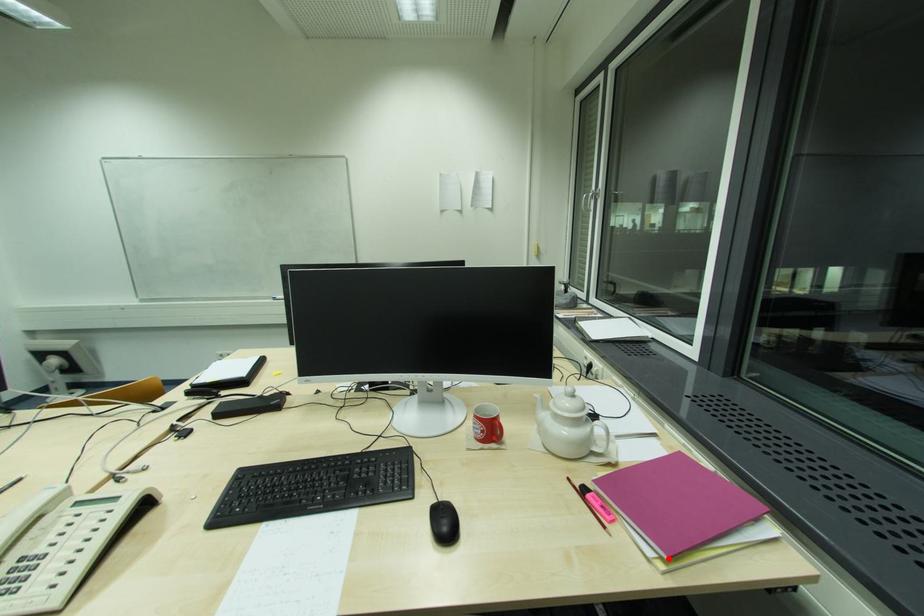
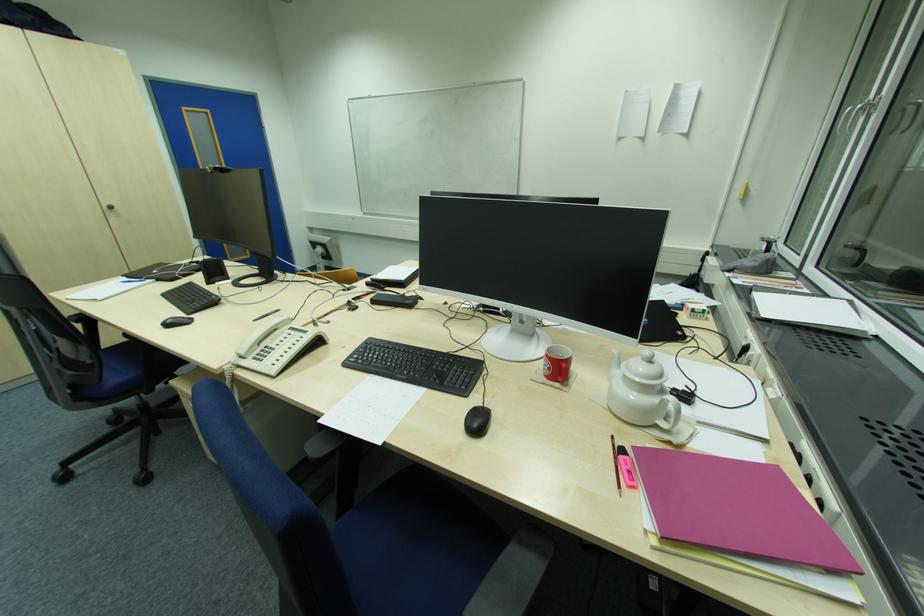
The point at the highlighted location is marked in the first image. Where is the corresponding point in the second image?

(662, 537)